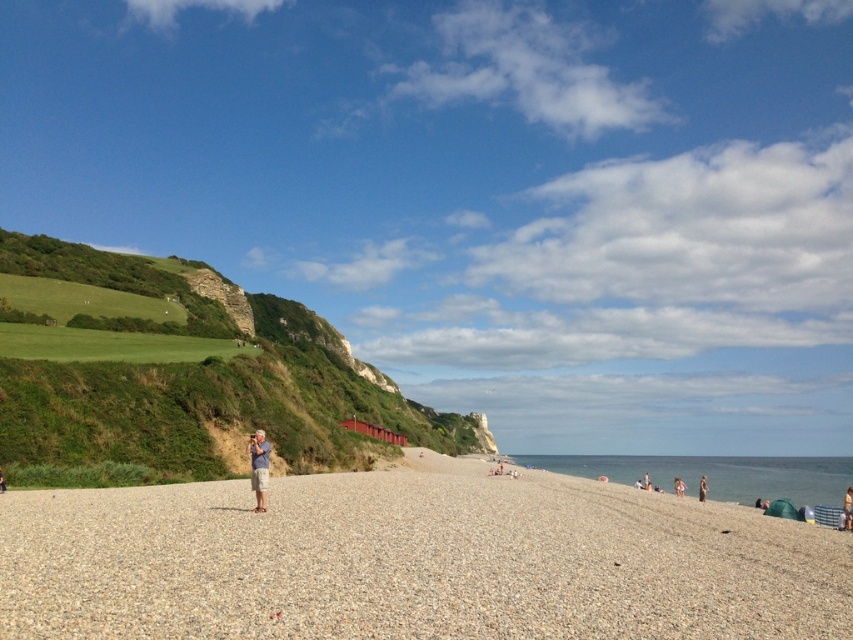
You are a photographer planning to take a panoramic shot of the coastal scene. You want to ensure that both the green grassy hillside at left and the brown fabric person at lower right are fully visible in the frame. Given their sizes, which object will occupy more space in the photo?

The green grassy hillside at left will occupy more space in the photo because its width is larger than that of the brown fabric person at lower right.

You are a photographer planning to capture the entire beach scene in one shot. Considering the brown fabric person at lower right and the light brown sand at lower right, which object will take up more area in your photo?

The light brown sand at lower right takes up more area in the photo than the brown fabric person at lower right because the brown fabric person at lower right occupies less space than light brown sand at lower right.